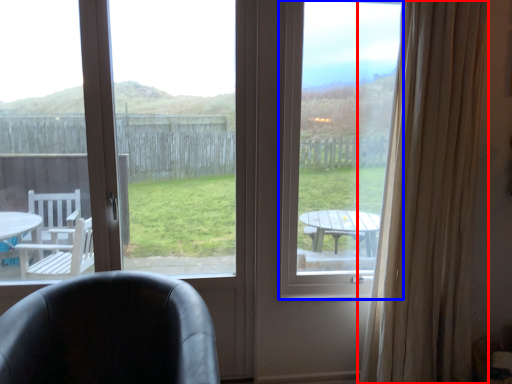
Question: Which object is further to the camera taking this photo, curtain (highlighted by a red box) or window screen (highlighted by a blue box)?

Choices:
 (A) curtain
 (B) window screen

Answer: (B)